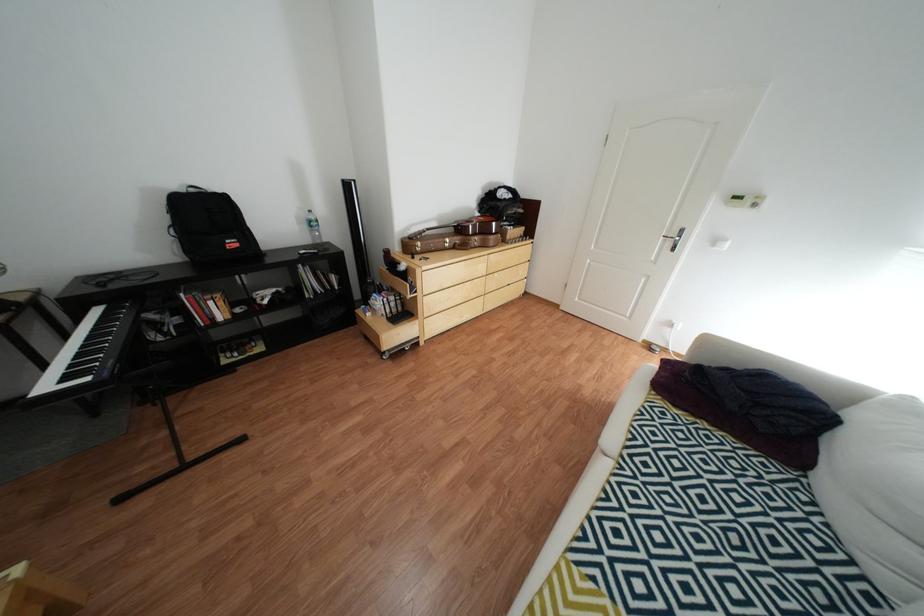
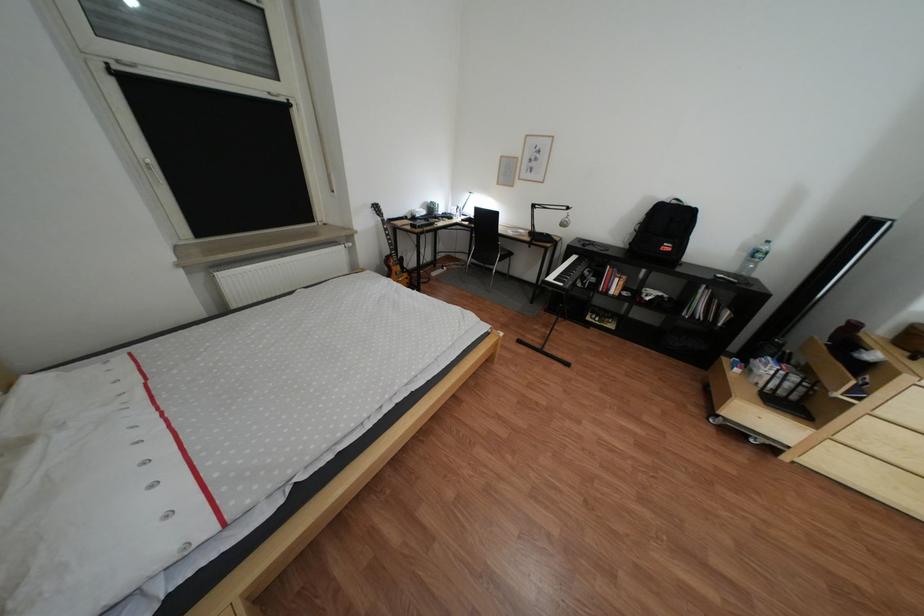
Find the pixel in the second image that matches point (117, 286) in the first image.

(600, 246)